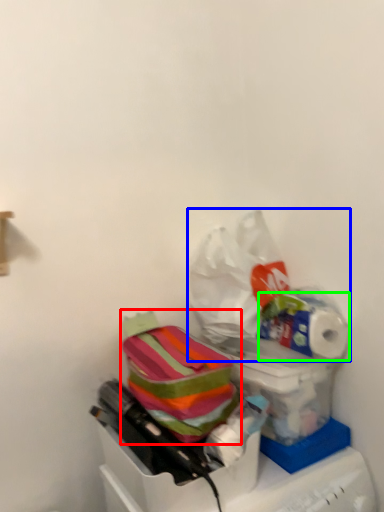
Question: Estimate the real-world distances between objects in this image. Which object is farther from material (highlighted by a red box), plastic bag (highlighted by a blue box) or toilet paper (highlighted by a green box)?

Choices:
 (A) plastic bag
 (B) toilet paper

Answer: (B)